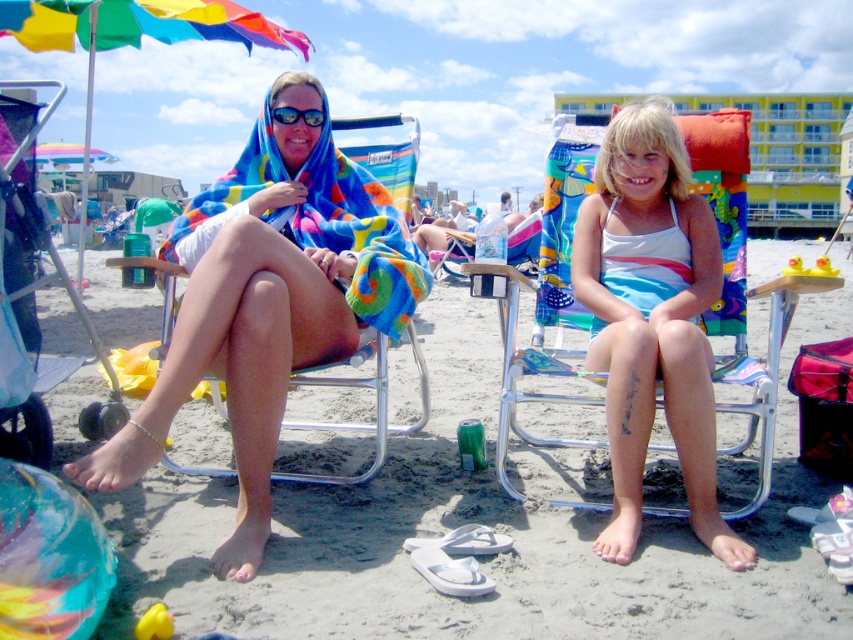
You are a photographer positioned at the back of the beach scene. You want to take a photo of the white satin dress at center without the metallic silver beach chair at left blocking it. Can you adjust your position to achieve this?

The white satin dress at center is further to the viewer than the metallic silver beach chair at left, so moving closer to the dress or adjusting the angle might allow you to capture it without the chair blocking the view.

You are a photographer trying to capture a closeup of the matte black goggles at center. You are currently standing near the multicolored towel at left. Can you move forward to get a better shot without moving the goggles?

The multicolored towel at left is closer to the viewer than matte black goggles at center, so you can move forward towards the matte black goggles at center from the multicolored towel at left to get a closer shot.